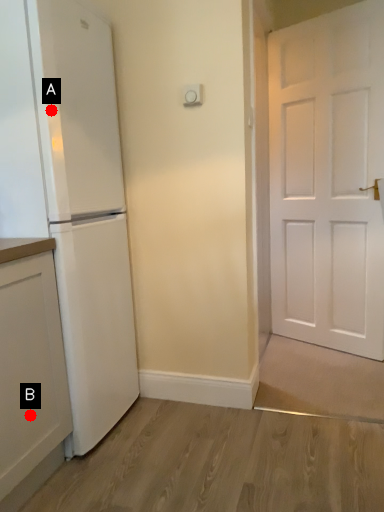
Question: Two points are circled on the image, labeled by A and B beside each circle. Among these points, which one is nearest to the camera?

Choices:
 (A) A is closer
 (B) B is closer

Answer: (B)